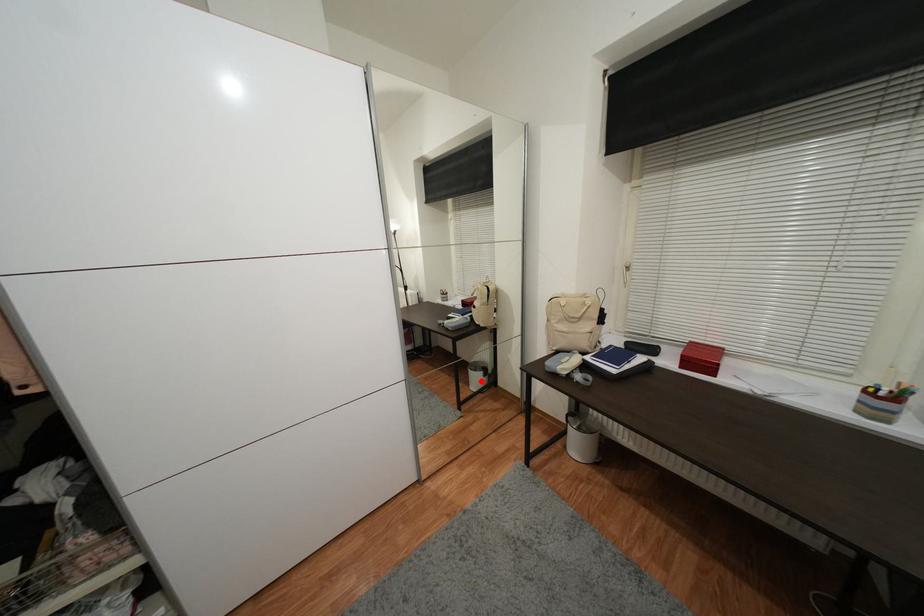
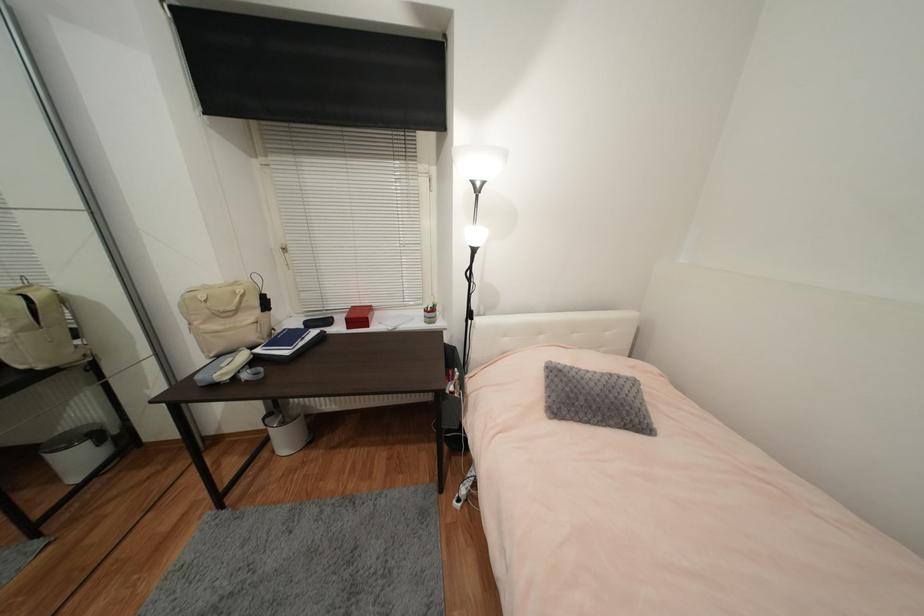
Question: A red point is marked in image1. In image2, is the corresponding 3D point closer to the camera or farther? Reply with the corresponding letter.

Choices:
 (A) The corresponding 3D point is closer.
 (B) The corresponding 3D point is farther.

Answer: (A)